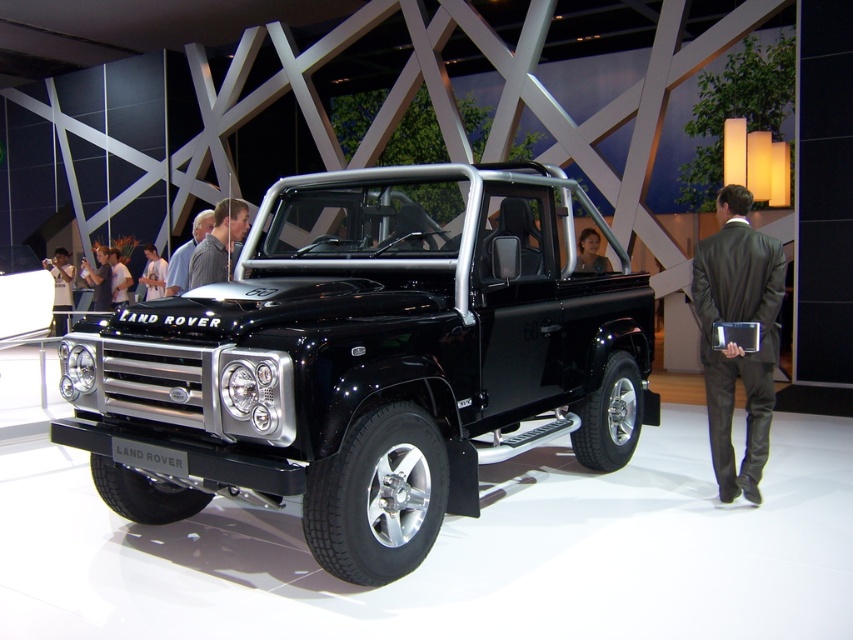
Question: Is striped shirt at center below light blue shirt at center?

Choices:
 (A) yes
 (B) no

Answer: (A)

Question: Which object appears closest to the camera in this image?

Choices:
 (A) light blue shirt at center
 (B) gray striped shirt at center
 (C) black metallic truck at center
 (D) striped shirt at center

Answer: (C)

Question: Which of the following is the farthest from the observer?

Choices:
 (A) (157, 289)
 (B) (49, 259)

Answer: (B)

Question: Considering the relative positions of black metallic truck at center and white shirt at center in the image provided, where is black metallic truck at center located with respect to white shirt at center?

Choices:
 (A) left
 (B) right

Answer: (B)

Question: Which object appears closest to the camera in this image?

Choices:
 (A) striped shirt at center
 (B) white shirt at center
 (C) matte black shirt at center
 (D) black metallic truck at center

Answer: (D)

Question: Is striped shirt at center thinner than light blue shirt at center?

Choices:
 (A) yes
 (B) no

Answer: (A)